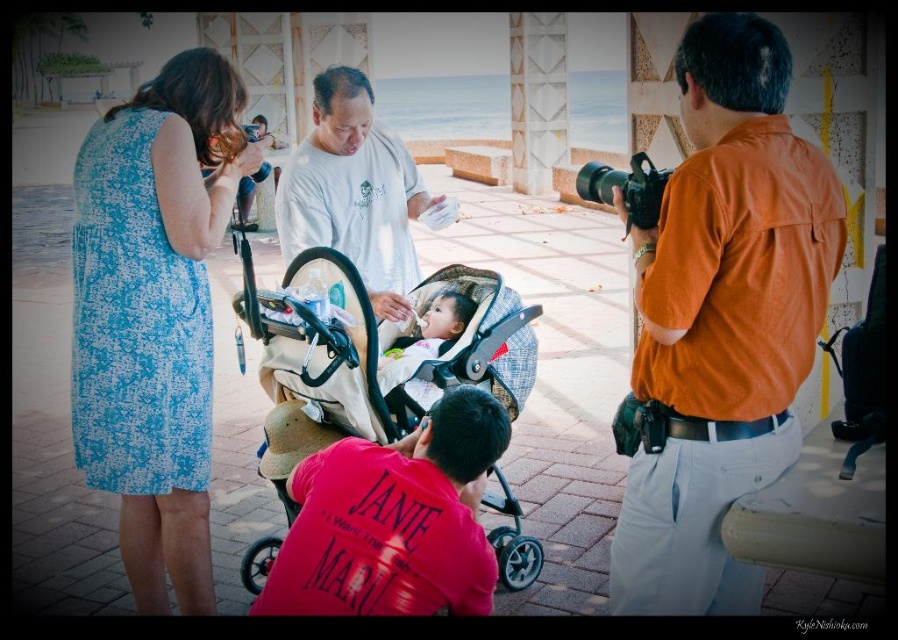
You are a photographer trying to capture a wide shot of the orange cotton shirt at right and the black plastic camera at right. Since you want both items to be clearly visible in the frame, which object should you prioritize positioning closer to the camera to ensure it doesn not get cropped out?

The orange cotton shirt at right is wider than the black plastic camera at right, so you should prioritize positioning the orange cotton shirt at right closer to the camera to ensure it doesn not get cropped out.

You are a photographer trying to capture a photo of the orange cotton shirt at right and the black plastic camera at right. Since you want both subjects to be in focus, which one should you adjust your focus on first?

The orange cotton shirt at right is closer to the viewer than the black plastic camera at right, so you should focus on the orange cotton shirt at right first to ensure both are in focus.